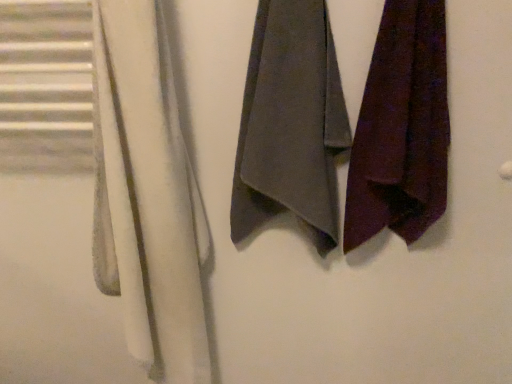
Question: Does dark gray fabric towel at center, arranged as the 2th towel when viewed from the right, come in front of white soft towel at left?

Choices:
 (A) yes
 (B) no

Answer: (B)

Question: Is dark gray fabric towel at center, arranged as the 2th towel when viewed from the right, shorter than white soft towel at left?

Choices:
 (A) no
 (B) yes

Answer: (B)

Question: Considering the relative sizes of dark gray fabric towel at center, which ranks as the first towel in left-to-right order, and white soft towel at left in the image provided, is dark gray fabric towel at center, which ranks as the first towel in left-to-right order, wider than white soft towel at left?

Choices:
 (A) yes
 (B) no

Answer: (B)

Question: Is dark gray fabric towel at center, which ranks as the first towel in left-to-right order, bigger than white soft towel at left?

Choices:
 (A) yes
 (B) no

Answer: (B)

Question: Is dark gray fabric towel at center, which ranks as the first towel in left-to-right order, in contact with white soft towel at left?

Choices:
 (A) yes
 (B) no

Answer: (B)

Question: From a real-world perspective, is dark gray fabric towel at center, arranged as the 2th towel when viewed from the right, on white soft towel at left?

Choices:
 (A) yes
 (B) no

Answer: (A)

Question: From a real-world perspective, is dark purple fabric at right, the second towel positioned from the left, below white soft towel at left?

Choices:
 (A) yes
 (B) no

Answer: (B)

Question: Is the depth of dark purple fabric at right, the second towel positioned from the left, less than that of white soft towel at left?

Choices:
 (A) yes
 (B) no

Answer: (B)

Question: Is dark purple fabric at right, the first towel when ordered from right to left, facing away from white soft towel at left?

Choices:
 (A) yes
 (B) no

Answer: (B)

Question: From the image's perspective, is dark purple fabric at right, the first towel when ordered from right to left, beneath white soft towel at left?

Choices:
 (A) yes
 (B) no

Answer: (B)

Question: Considering the relative positions of dark purple fabric at right, the second towel positioned from the left, and white soft towel at left in the image provided, is dark purple fabric at right, the second towel positioned from the left, to the right of white soft towel at left from the viewer's perspective?

Choices:
 (A) yes
 (B) no

Answer: (A)

Question: Does dark purple fabric at right, the first towel when ordered from right to left, turn towards white soft towel at left?

Choices:
 (A) yes
 (B) no

Answer: (B)

Question: Can you confirm if dark purple fabric at right, the first towel when ordered from right to left, is shorter than dark gray fabric towel at center, arranged as the 2th towel when viewed from the right?

Choices:
 (A) yes
 (B) no

Answer: (A)